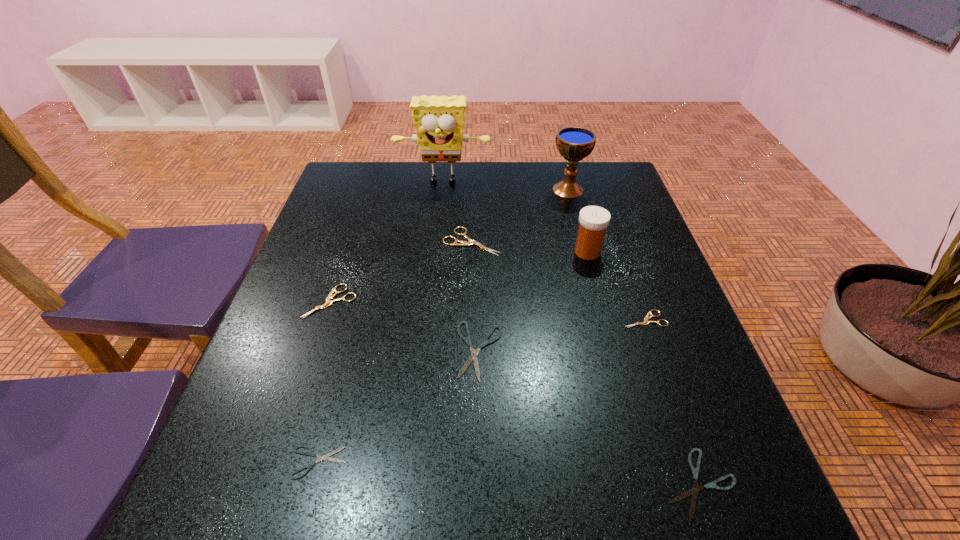
Image resolution: width=960 pixels, height=540 pixels. Find the location of `the second black shears from left to right`. the second black shears from left to right is located at coordinates (473, 357).

Identify the location of the farthest black shears. This screenshot has height=540, width=960. (473, 357).

I want to click on the smallest beige shears, so click(646, 322).

Find the location of a particular element. This screenshot has width=960, height=540. the second biggest black shears is located at coordinates (694, 491).

Where is `the smallest black shears`? The height and width of the screenshot is (540, 960). the smallest black shears is located at coordinates (311, 453).

At what (x,y) coordinates should I click in order to perform the action: click on the shortest shears. Please return your answer as a coordinate pair (x, y). Looking at the image, I should click on (311, 453).

Identify the location of vacant region located on the front-facing side of the tallest object. The width and height of the screenshot is (960, 540). (433, 273).

Find the location of `vacant region located 0.200m on the left of the chalice`. vacant region located 0.200m on the left of the chalice is located at coordinates (481, 190).

Where is `vacant space located 0.100m on the left of the seventh shortest object`? The image size is (960, 540). vacant space located 0.100m on the left of the seventh shortest object is located at coordinates (532, 252).

Find the location of a particular element. vacant point located on the left of the fourth tallest object is located at coordinates (420, 241).